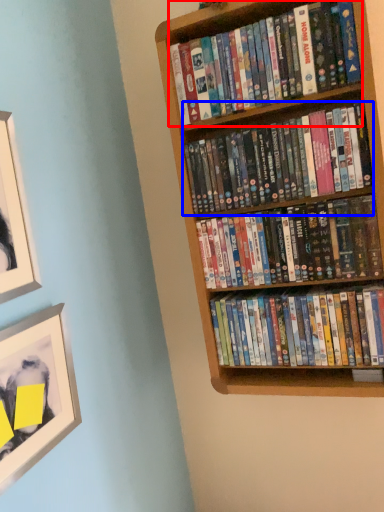
Question: Which of the following is the farthest to the observer, book (highlighted by a red box) or book (highlighted by a blue box)?

Choices:
 (A) book
 (B) book

Answer: (B)